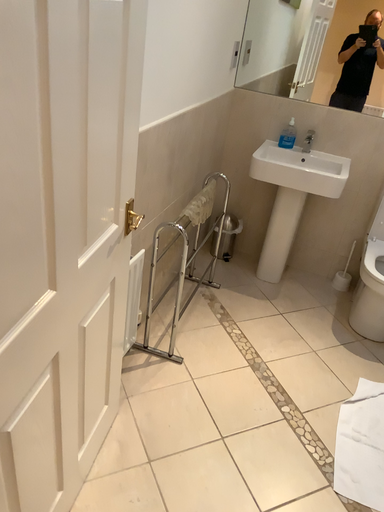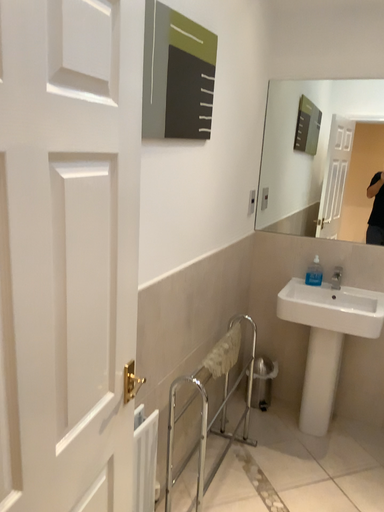
Question: How did the camera likely rotate when shooting the video?

Choices:
 (A) rotated upward
 (B) rotated downward

Answer: (A)